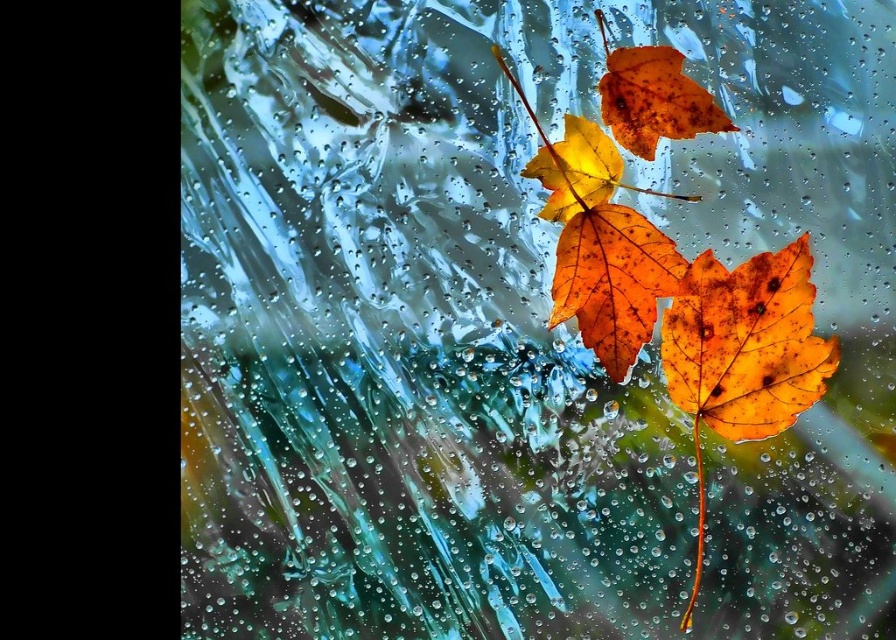
You are an artist trying to paint the scene. You notice the orange matte maple leaf at center and the rustic brown leaf at upper center. Which leaf should you paint smaller in width to accurately represent their sizes?

The orange matte maple leaf at center has a lesser width compared to the rustic brown leaf at upper center, so you should paint the orange matte maple leaf at center smaller in width.

You are a scientist measuring the spacing between leaves for a study. Given that the minimum required distance between two leaves for your experiment is 1 inch, will the orange matte maple leaf at center and the rustic brown leaf at upper center meet the requirement?

The distance between the orange matte maple leaf at center and the rustic brown leaf at upper center is 0.94 inches, which is less than the required 1 inch. Therefore, they do not meet the requirement.